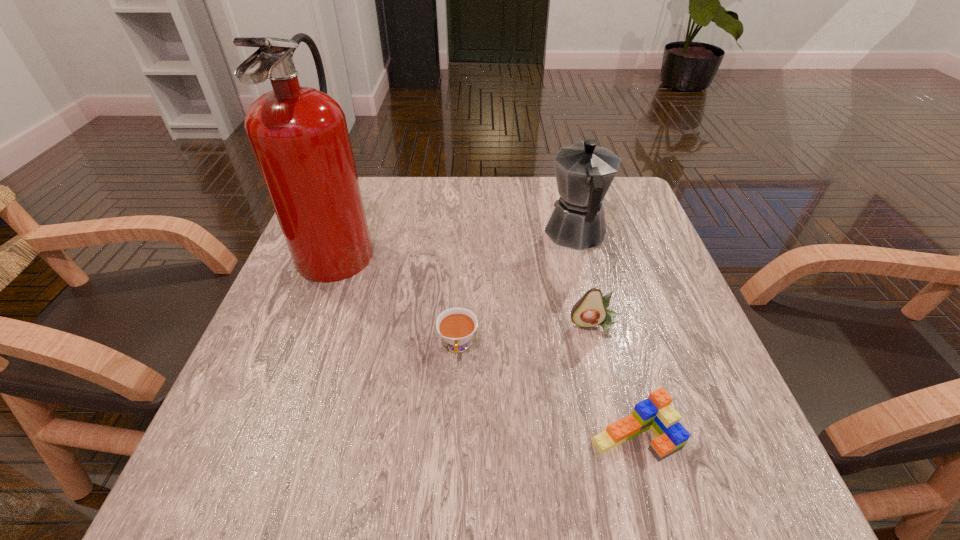
Identify the location of vacant region located 0.330m on the left of the Lego. Image resolution: width=960 pixels, height=540 pixels. (376, 436).

Where is `vacant space positioned on the side of the teacup with the handle`? The image size is (960, 540). vacant space positioned on the side of the teacup with the handle is located at coordinates (451, 490).

The width and height of the screenshot is (960, 540). Find the location of `fire extinguisher that is at the far edge`. fire extinguisher that is at the far edge is located at coordinates (299, 136).

At what (x,y) coordinates should I click in order to perform the action: click on coffeepot present at the far edge. Please return your answer as a coordinate pair (x, y). Image resolution: width=960 pixels, height=540 pixels. Looking at the image, I should click on (584, 172).

The height and width of the screenshot is (540, 960). Identify the location of object that is at the near edge. (655, 413).

Locate an element on the screen. This screenshot has width=960, height=540. object present at the left edge is located at coordinates (299, 136).

At what (x,y) coordinates should I click in order to perform the action: click on coffeepot that is at the right edge. Please return your answer as a coordinate pair (x, y). Looking at the image, I should click on (584, 172).

Where is `avocado located in the right edge section of the desktop`? The width and height of the screenshot is (960, 540). avocado located in the right edge section of the desktop is located at coordinates (590, 310).

Locate an element on the screen. The width and height of the screenshot is (960, 540). Lego located at the right edge is located at coordinates (655, 413).

You are a GUI agent. You are given a task and a screenshot of the screen. Output one action in this format:
    pyautogui.click(x=<x>, y=<y>)
    Task: Click on the object positioned at the far left corner
    This screenshot has height=540, width=960.
    Given the screenshot: What is the action you would take?
    pyautogui.click(x=299, y=136)